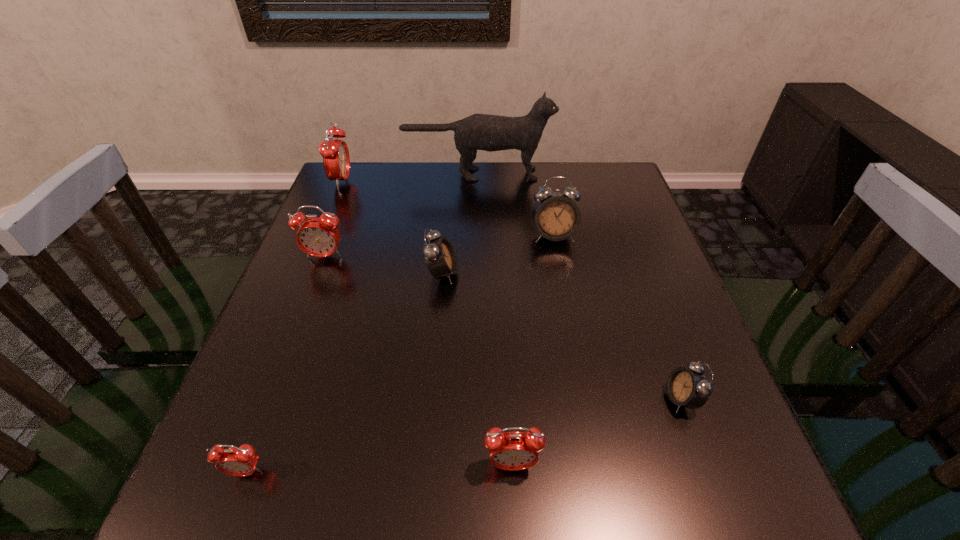
Where is `the rightmost red alarm clock`? Image resolution: width=960 pixels, height=540 pixels. the rightmost red alarm clock is located at coordinates (513, 450).

You are a GUI agent. You are given a task and a screenshot of the screen. Output one action in this format:
    pyautogui.click(x=<x>, y=<y>)
    Task: Click on the rightmost alarm clock
    
    Given the screenshot: What is the action you would take?
    pyautogui.click(x=689, y=387)

You are a GUI agent. You are given a task and a screenshot of the screen. Output one action in this format:
    pyautogui.click(x=<x>, y=<y>)
    Task: Click on the smallest white alarm clock
    
    Given the screenshot: What is the action you would take?
    pyautogui.click(x=689, y=387)

You are a GUI agent. You are given a task and a screenshot of the screen. Output one action in this format:
    pyautogui.click(x=<x>, y=<y>)
    Task: Click on the smallest red alarm clock
    Image resolution: width=960 pixels, height=540 pixels.
    Given the screenshot: What is the action you would take?
    pyautogui.click(x=241, y=461)

The height and width of the screenshot is (540, 960). I want to click on free space located 0.120m on the front-facing side of the cat, so click(x=590, y=174).

Find the location of a particular element. The image size is (960, 540). free spot located 0.110m on the face of the farthest alarm clock is located at coordinates (389, 182).

Locate an element on the screen. blank space located 0.140m on the face of the second alarm clock from right to left is located at coordinates (564, 288).

The height and width of the screenshot is (540, 960). What are the coordinates of `free location located 0.220m on the face of the third smallest red alarm clock` in the screenshot? It's located at (295, 336).

This screenshot has width=960, height=540. Find the location of `vacant space located on the face of the fourth alarm clock from left to right`. vacant space located on the face of the fourth alarm clock from left to right is located at coordinates (588, 273).

Image resolution: width=960 pixels, height=540 pixels. What are the coordinates of `vacant region located on the face of the rightmost alarm clock` in the screenshot? It's located at (487, 399).